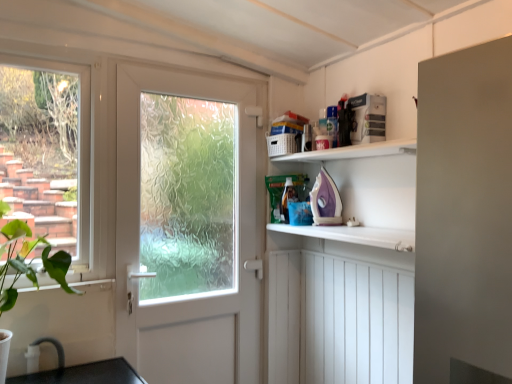
This screenshot has width=512, height=384. Find the location of `green leafy plant at lower left`. green leafy plant at lower left is located at coordinates (29, 262).

What is the approximate width of white frosted glass door at center?

white frosted glass door at center is 4.71 inches wide.

This screenshot has height=384, width=512. What are the coordinates of `green leafy plant at lower left` in the screenshot? It's located at (29, 262).

How much distance is there between green leafy plant at lower left and clear glass window at left?

green leafy plant at lower left is 14.89 inches away from clear glass window at left.

Is green leafy plant at lower left taller or shorter than clear glass window at left?

Considering their sizes, green leafy plant at lower left has less height than clear glass window at left.

From a real-world perspective, is green leafy plant at lower left under clear glass window at left?

Yes, from a real-world perspective, green leafy plant at lower left is below clear glass window at left.

Which object is further away from the camera, white frosted glass door at center or green leafy plant at lower left?

Positioned behind is white frosted glass door at center.

Is white frosted glass door at center bigger than green leafy plant at lower left?

Yes, white frosted glass door at center is bigger than green leafy plant at lower left.

Between white frosted glass door at center and green leafy plant at lower left, which one has less height?

green leafy plant at lower left.

Which of these two, white frosted glass door at center or green leafy plant at lower left, is thinner?

With smaller width is white frosted glass door at center.

From the image's perspective, which is below, clear glass window at left or white frosted glass door at center?

white frosted glass door at center is shown below in the image.

Considering the positions of objects clear glass window at left and white frosted glass door at center in the image provided, who is in front, clear glass window at left or white frosted glass door at center?

clear glass window at left is more forward.

Could white frosted glass door at center be considered to be inside clear glass window at left?

No, white frosted glass door at center is not a part of clear glass window at left.

In the scene shown: Can you confirm if clear glass window at left is positioned to the right of white frosted glass door at center?

No, clear glass window at left is not to the right of white frosted glass door at center.

Considering the sizes of green leafy plant at lower left and white frosted glass door at center in the image, is green leafy plant at lower left bigger or smaller than white frosted glass door at center?

Clearly, green leafy plant at lower left is smaller in size than white frosted glass door at center.

Is the depth of green leafy plant at lower left greater than that of white frosted glass door at center?

No, it is not.

From the image's perspective, which is above, green leafy plant at lower left or white frosted glass door at center?

white frosted glass door at center appears higher in the image.

Based on the photo, does green leafy plant at lower left turn towards white frosted glass door at center?

No, green leafy plant at lower left is not turned towards white frosted glass door at center.

Is point (28, 86) closer or farther from the camera than point (70, 288)?

Clearly, point (28, 86) is more distant from the camera than point (70, 288).

In the scene shown: Which of these two, clear glass window at left or green leafy plant at lower left, is wider?

Wider between the two is green leafy plant at lower left.

Considering the positions of objects clear glass window at left and green leafy plant at lower left in the image provided, who is in front, clear glass window at left or green leafy plant at lower left?

green leafy plant at lower left.

Looking at this image, is clear glass window at left positioned with its back to green leafy plant at lower left?

That's not correct — clear glass window at left is not looking away from green leafy plant at lower left.

Is white frosted glass door at center outside of clear glass window at left?

Yes.

Which object is wider, white frosted glass door at center or clear glass window at left?

white frosted glass door at center is wider.

Considering the relative positions of white frosted glass door at center and clear glass window at left in the image provided, is white frosted glass door at center behind clear glass window at left?

That is True.

From a real-world perspective, is white frosted glass door at center physically located above or below clear glass window at left?

In terms of real-world spatial position, white frosted glass door at center is below clear glass window at left.

This screenshot has height=384, width=512. I want to click on plant located on the right of clear glass window at left, so click(29, 262).

This screenshot has height=384, width=512. What are the coordinates of `door behind the green leafy plant at lower left` in the screenshot? It's located at [236, 242].

From the image, which object appears to be nearer to clear glass window at left, green leafy plant at lower left or white frosted glass door at center?

green leafy plant at lower left is closer to clear glass window at left.

Looking at the image, which one is located further to white frosted glass door at center, clear glass window at left or green leafy plant at lower left?

green leafy plant at lower left is further to white frosted glass door at center.

Considering their positions, is white frosted glass door at center positioned closer to green leafy plant at lower left than clear glass window at left?

Among the two, clear glass window at left is located nearer to green leafy plant at lower left.

Based on their spatial positions, is white frosted glass door at center or green leafy plant at lower left closer to clear glass window at left?

green leafy plant at lower left.

Considering their positions, is green leafy plant at lower left positioned further to white frosted glass door at center than clear glass window at left?

green leafy plant at lower left is further to white frosted glass door at center.

Looking at the image, which one is located further to green leafy plant at lower left, clear glass window at left or white frosted glass door at center?

white frosted glass door at center.

This screenshot has height=384, width=512. What are the coordinates of `plant between clear glass window at left and white frosted glass door at center in the horizontal direction` in the screenshot? It's located at (29, 262).